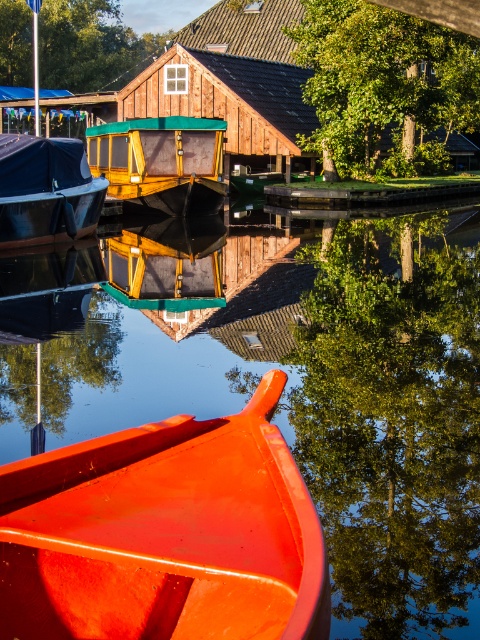
You are standing at the riverside and see the glossy orange canoe at lower center and the green leafy tree at upper left. Which object is positioned more to the right side of the scene?

The glossy orange canoe at lower center is positioned more to the right side of the scene compared to the green leafy tree at upper left.

You are an observer standing at the riverside. You see the glossy wooden boat at lower left and the green leafy tree at upper left. Which object appears closer to you?

The glossy wooden boat at lower left appears closer to you because it is positioned in the foreground of the scene, while the green leafy tree at upper left is located in the background.

You are standing at the riverside and see the glossy orange canoe at lower center and the green leafy tree at upper left. Which object is closer to you?

The glossy orange canoe at lower center is closer to you because it is positioned in front of the green leafy tree at upper left.